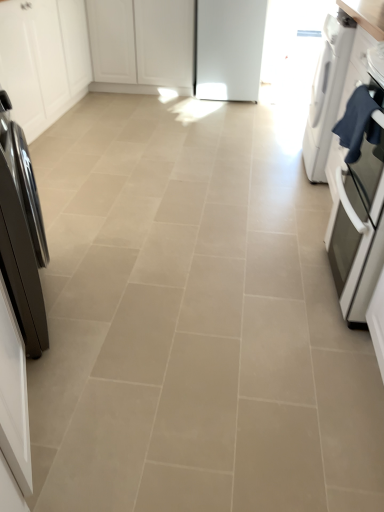
Question: Does white matte cabinet at upper left, acting as the first cabinetry starting from the left, appear on the right side of white matte cabinet at center, the second cabinetry viewed from the left?

Choices:
 (A) yes
 (B) no

Answer: (B)

Question: Are white matte cabinet at upper left, acting as the first cabinetry starting from the left, and white matte cabinet at center, the first cabinetry when ordered from right to left, making contact?

Choices:
 (A) yes
 (B) no

Answer: (B)

Question: Considering the relative positions of white matte cabinet at upper left, acting as the first cabinetry starting from the left, and white matte cabinet at center, the second cabinetry viewed from the left, in the image provided, is white matte cabinet at upper left, acting as the first cabinetry starting from the left, to the left of white matte cabinet at center, the second cabinetry viewed from the left, from the viewer's perspective?

Choices:
 (A) yes
 (B) no

Answer: (A)

Question: Can white matte cabinet at center, the first cabinetry when ordered from right to left, be found inside white matte cabinet at upper left, acting as the first cabinetry starting from the left?

Choices:
 (A) yes
 (B) no

Answer: (B)

Question: Can you confirm if white matte cabinet at upper left, acting as the first cabinetry starting from the left, is wider than white matte cabinet at center, the first cabinetry when ordered from right to left?

Choices:
 (A) no
 (B) yes

Answer: (A)

Question: Considering the relative sizes of white matte cabinet at upper left, the 2th cabinetry from the right, and white matte cabinet at center, the first cabinetry when ordered from right to left, in the image provided, is white matte cabinet at upper left, the 2th cabinetry from the right, taller than white matte cabinet at center, the first cabinetry when ordered from right to left,?

Choices:
 (A) yes
 (B) no

Answer: (A)

Question: From the image's perspective, would you say matte stainless steel oven at right is positioned over shiny black refrigerator at left, positioned as the 2th home appliance in top-to-bottom order?

Choices:
 (A) yes
 (B) no

Answer: (A)

Question: Is matte stainless steel oven at right positioned behind shiny black refrigerator at left, the 1th home appliance from the front?

Choices:
 (A) no
 (B) yes

Answer: (B)

Question: Does matte stainless steel oven at right have a smaller size compared to shiny black refrigerator at left, the 1th home appliance from the left?

Choices:
 (A) no
 (B) yes

Answer: (A)

Question: From a real-world perspective, is matte stainless steel oven at right under shiny black refrigerator at left, positioned as the 2th home appliance in top-to-bottom order?

Choices:
 (A) yes
 (B) no

Answer: (A)

Question: Considering the relative sizes of matte stainless steel oven at right and shiny black refrigerator at left, which is the second home appliance from back to front, in the image provided, is matte stainless steel oven at right wider than shiny black refrigerator at left, which is the second home appliance from back to front,?

Choices:
 (A) no
 (B) yes

Answer: (B)

Question: Is matte stainless steel oven at right turned away from shiny black refrigerator at left, positioned as the 2th home appliance in top-to-bottom order?

Choices:
 (A) no
 (B) yes

Answer: (A)

Question: Is white glossy dryer at right, positioned as the first home appliance in top-to-bottom order, bigger than shiny black refrigerator at left, positioned as the 2th home appliance in top-to-bottom order?

Choices:
 (A) yes
 (B) no

Answer: (A)